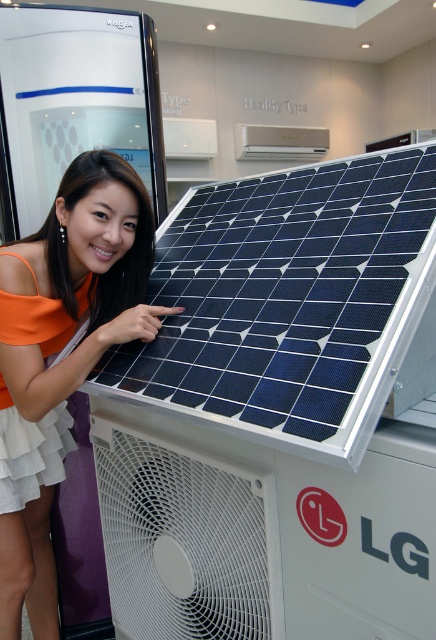
Is white plastic fan at lower center taller than white glossy air conditioner at upper center?

Correct, white plastic fan at lower center is much taller as white glossy air conditioner at upper center.

Between point (225, 566) and point (316, 150), which one is positioned behind?

The point (316, 150) is behind.

I want to click on white plastic fan at lower center, so click(x=186, y=540).

Does point (41, 246) come in front of point (269, 129)?

That is True.

Who is more forward, (51, 582) or (310, 141)?

Positioned in front is point (51, 582).

This screenshot has width=436, height=640. Describe the element at coordinates (64, 358) in the screenshot. I see `orange fabric dress at center` at that location.

At what (x,y) coordinates should I click in order to perform the action: click on orange fabric dress at center. Please return your answer as a coordinate pair (x, y). Looking at the image, I should click on (64, 358).

Who is positioned more to the right, orange fabric dress at center or white plastic fan at lower center?

white plastic fan at lower center is more to the right.

At what (x,y) coordinates should I click in order to perform the action: click on orange fabric dress at center. Please return your answer as a coordinate pair (x, y). This screenshot has width=436, height=640. Looking at the image, I should click on (64, 358).

Locate an element on the screen. Image resolution: width=436 pixels, height=640 pixels. orange fabric dress at center is located at coordinates 64,358.